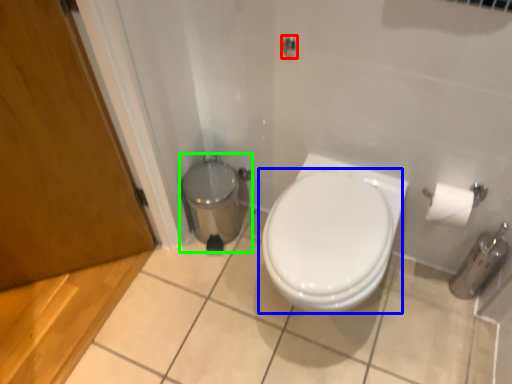
Question: Based on their relative distances, which object is nearer to shower (highlighted by a red box)? Choose from toilet (highlighted by a blue box) and porcelain (highlighted by a green box).

Choices:
 (A) toilet
 (B) porcelain

Answer: (A)